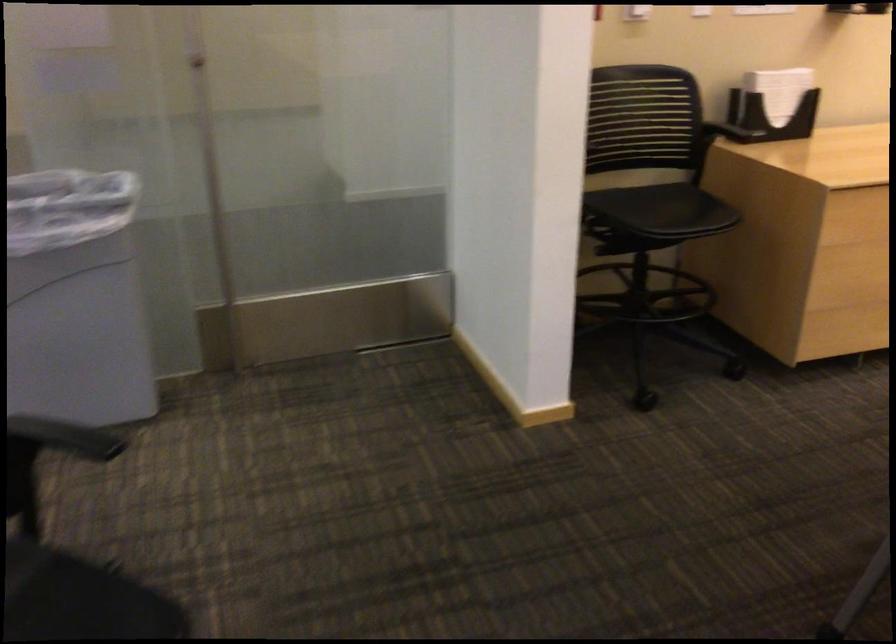
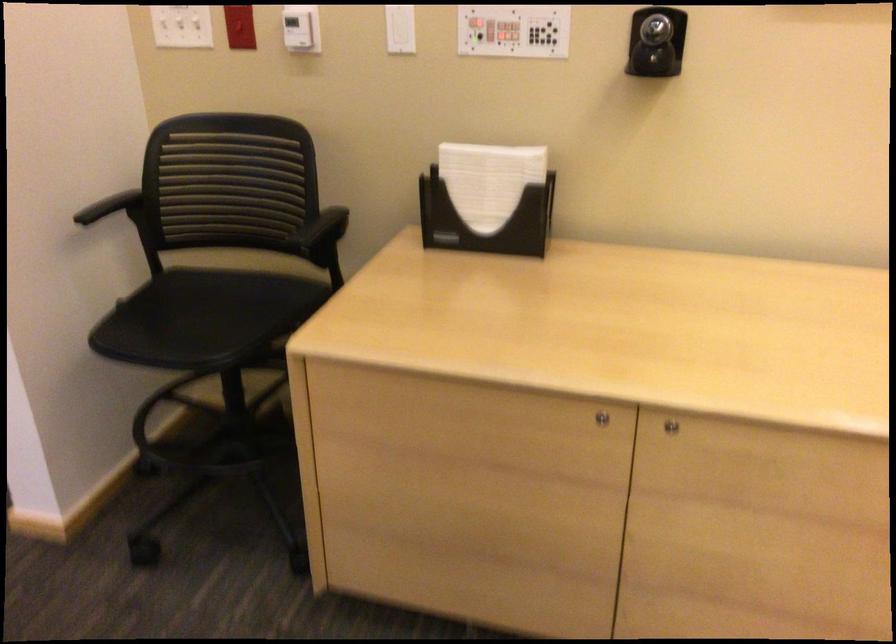
The point at (782, 82) is marked in the first image. Where is the corresponding point in the second image?

(488, 180)